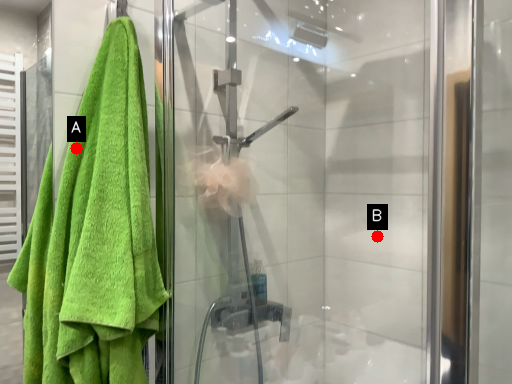
Question: Two points are circled on the image, labeled by A and B beside each circle. Among these points, which one is nearest to the camera?

Choices:
 (A) A is closer
 (B) B is closer

Answer: (A)